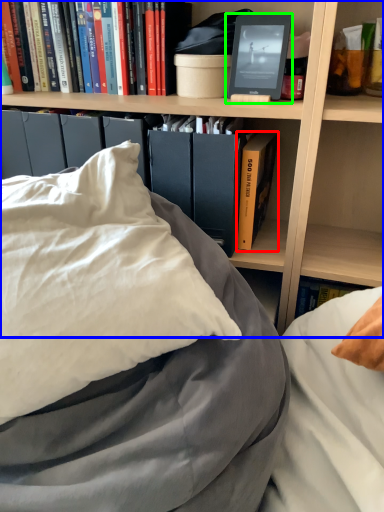
Question: Based on their relative distances, which object is farther from book (highlighted by a red box)? Choose from bookcase (highlighted by a blue box) and paperback book (highlighted by a green box).

Choices:
 (A) bookcase
 (B) paperback book

Answer: (B)